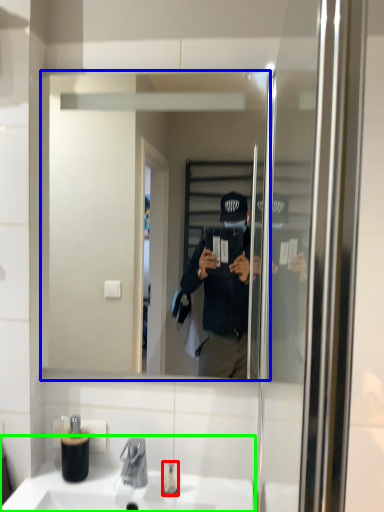
Question: Which object is the farthest from toiletry (highlighted by a red box)? Choose among these: mirror (highlighted by a blue box) or sink (highlighted by a green box).

Choices:
 (A) mirror
 (B) sink

Answer: (A)